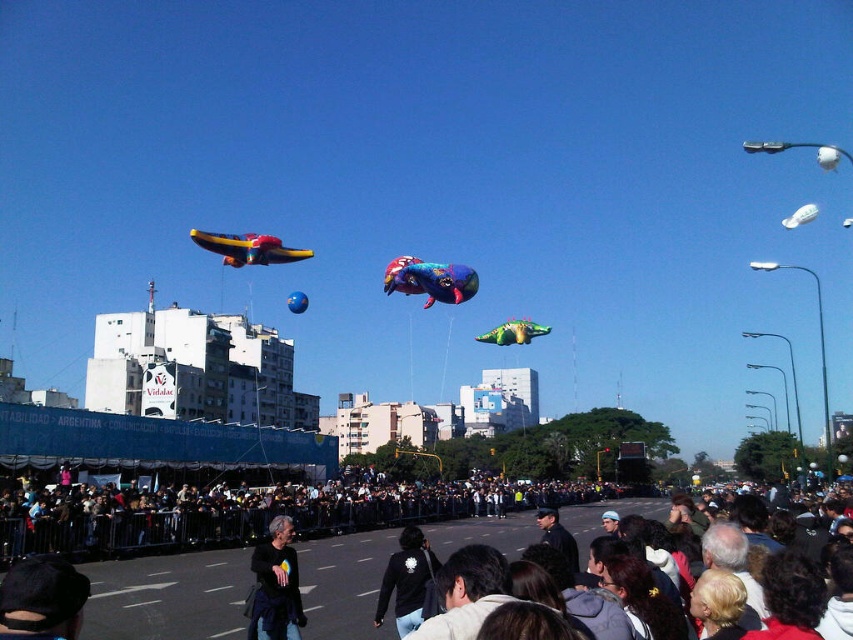
Which of these two, black matte shirt at center or green matte balloon at center, stands shorter?

green matte balloon at center is shorter.

Can you confirm if black matte shirt at center is taller than green matte balloon at center?

Yes, black matte shirt at center is taller than green matte balloon at center.

This screenshot has width=853, height=640. In order to click on black matte shirt at center in this screenshot , I will do click(x=276, y=586).

Identify the location of black matte shirt at center. The image size is (853, 640). (276, 586).

Can you confirm if dark gray crowd at lower center is shorter than dark brown hair at center?

Indeed, dark gray crowd at lower center has a lesser height compared to dark brown hair at center.

Identify the location of dark gray crowd at lower center. [x=219, y=524].

Describe the element at coordinates (407, 580) in the screenshot. The width and height of the screenshot is (853, 640). I see `black matte jacket at lower center` at that location.

Which is behind, point (415, 593) or point (289, 294)?

Point (289, 294)

You are a GUI agent. You are given a task and a screenshot of the screen. Output one action in this format:
    pyautogui.click(x=<x>, y=<y>)
    Task: Click on the black matte jacket at lower center
    This screenshot has width=853, height=640.
    Given the screenshot: What is the action you would take?
    pyautogui.click(x=407, y=580)